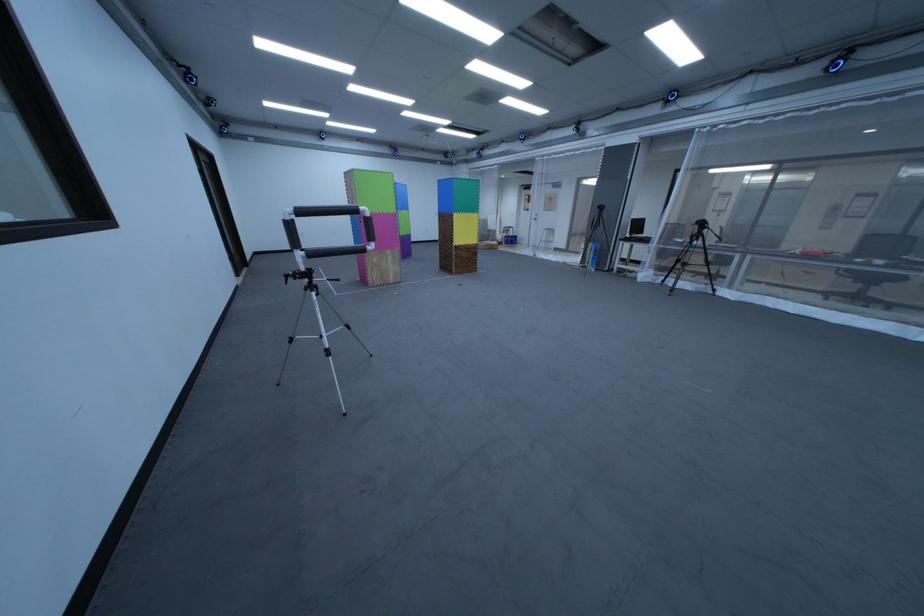
The image size is (924, 616). I want to click on stool sitting surface, so click(x=634, y=241).